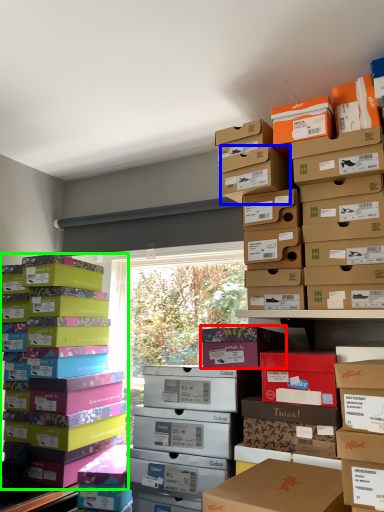
Question: Based on their relative distances, which object is farther from cardboard box (highlighted by a red box)? Choose from storage box (highlighted by a blue box) and box (highlighted by a green box).

Choices:
 (A) storage box
 (B) box

Answer: (B)